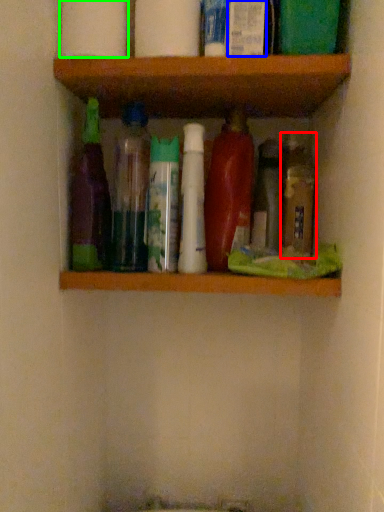
Question: Estimate the real-world distances between objects in this image. Which object is closer to bottle (highlighted by a red box), toiletry (highlighted by a blue box) or toilet paper (highlighted by a green box)?

Choices:
 (A) toiletry
 (B) toilet paper

Answer: (A)